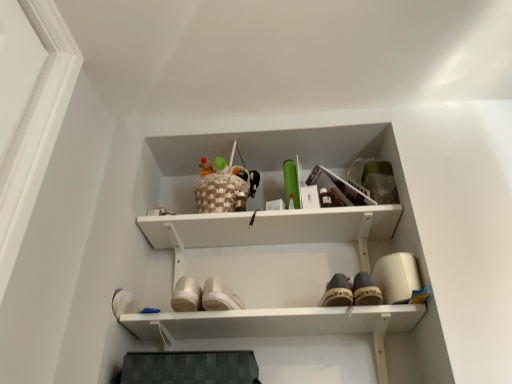
Locate an element on the screen. blank space situated above woven basket at upper center (from a real-world perspective) is located at coordinates (225, 145).